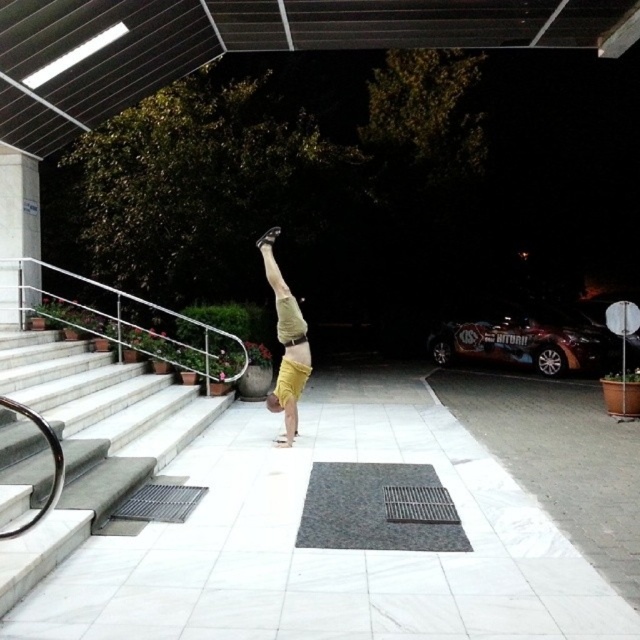
You are standing at the entrance of the building and see the white marble stairs at lower left and the yellow cotton shorts at center. Which object is positioned lower in the image?

The white marble stairs at lower left are positioned lower in the image than the yellow cotton shorts at center.